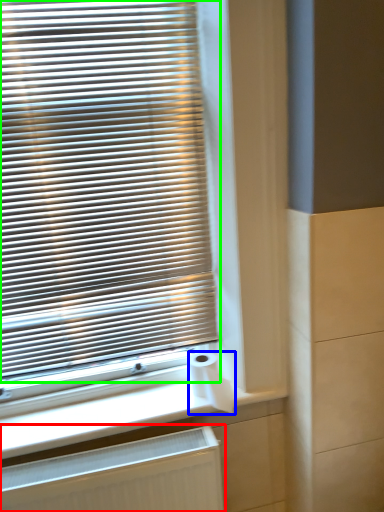
Question: Estimate the real-world distances between objects in this image. Which object is closer to radiator (highlighted by a red box), toilet paper (highlighted by a blue box) or window blind (highlighted by a green box)?

Choices:
 (A) toilet paper
 (B) window blind

Answer: (A)